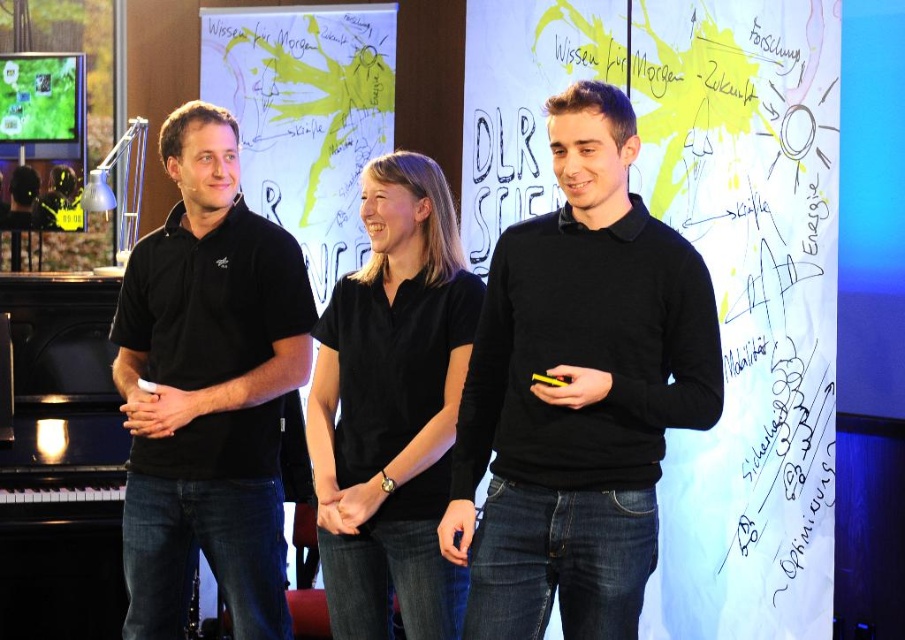
Can you confirm if black matte shirt at left is wider than black matte shirt at center?

Correct, the width of black matte shirt at left exceeds that of black matte shirt at center.

Who is positioned more to the left, black matte shirt at left or black matte shirt at center?

black matte shirt at left

Does point (211, 196) come closer to viewer compared to point (408, 538)?

No, (211, 196) is further to viewer.

The image size is (905, 640). Find the location of `black matte shirt at left`. black matte shirt at left is located at coordinates (208, 388).

Is black matte sweater at center bigger than black matte shirt at center?

Yes.

Does black matte sweater at center appear under black matte shirt at center?

No, black matte sweater at center is not below black matte shirt at center.

Between point (665, 234) and point (343, 276), which one is positioned in front?

Positioned in front is point (665, 234).

You are a GUI agent. You are given a task and a screenshot of the screen. Output one action in this format:
    pyautogui.click(x=<x>, y=<y>)
    Task: Click on the black matte sweater at center
    The image size is (905, 640).
    Given the screenshot: What is the action you would take?
    pyautogui.click(x=578, y=392)

Does black matte sweater at center appear on the left side of black matte shirt at left?

Incorrect, black matte sweater at center is not on the left side of black matte shirt at left.

Does black matte sweater at center have a lesser width compared to black matte shirt at left?

No.

Between point (660, 428) and point (278, 298), which one is positioned in front?

Point (660, 428) is more forward.

Where is `black matte sweater at center`? This screenshot has width=905, height=640. black matte sweater at center is located at coordinates (578, 392).